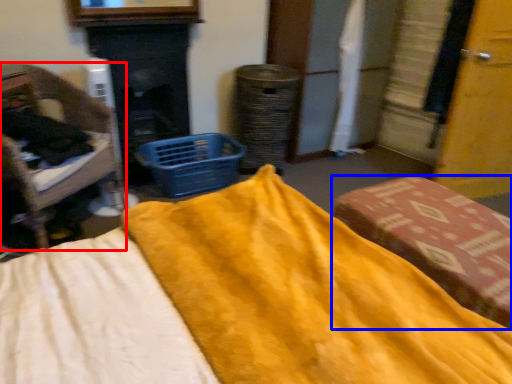
Question: Among these objects, which one is farthest to the camera, furniture (highlighted by a red box) or furniture (highlighted by a blue box)?

Choices:
 (A) furniture
 (B) furniture

Answer: (A)